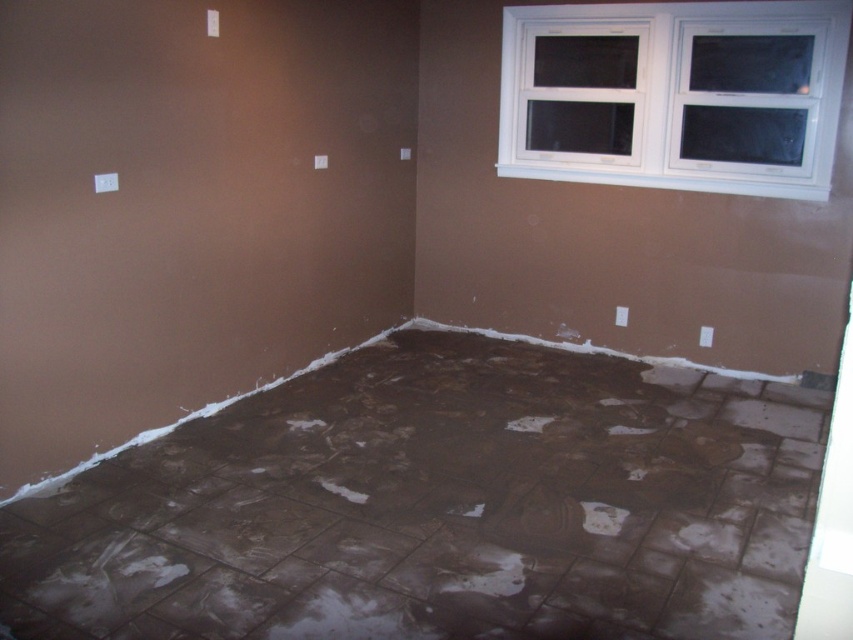
You are a contractor assessing the room. You need to place a 1.2 meter wide equipment between the brown matte tile floor at center and the white plastic window at upper right. Can the equipment fit horizontally between them?

The brown matte tile floor at center is wider than the white plastic window at upper right. Since the equipment is 1.2 meters wide, it might fit if the space between them is at least that width. However, the description only states the floor is wider, not the available space. Without exact measurements of the gap, it is uncertain if the equipment will fit.

You are an inspector checking the renovation site. You need to determine if the brown matte tile floor at center can accommodate a large equipment that requires a surface area larger than the white plastic window at upper right. Based on the scene, can the floor area suffice?

The brown matte tile floor at center is bigger than the white plastic window at upper right, so the floor area can accommodate the large equipment requiring a surface area larger than the window.

You are a construction worker standing at the point labeled point (x=437, y=506) in the room. What type of flooring material are you currently standing on?

The point (x=437, y=506) corresponds to the brown matte tile floor at center, so you are standing on brown matte tile flooring material.